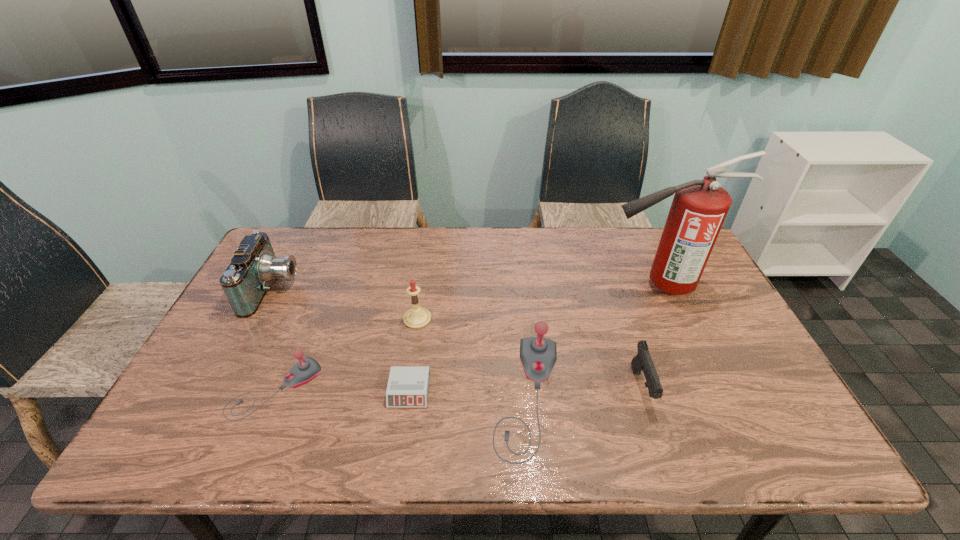
At what (x,y) coordinates should I click in order to perform the action: click on free location that satisfies the following two spatial constraints: 1. on the front-facing side of the alarm clock; 2. on the left side of the camcorder. Please return your answer as a coordinate pair (x, y). Looking at the image, I should click on (220, 391).